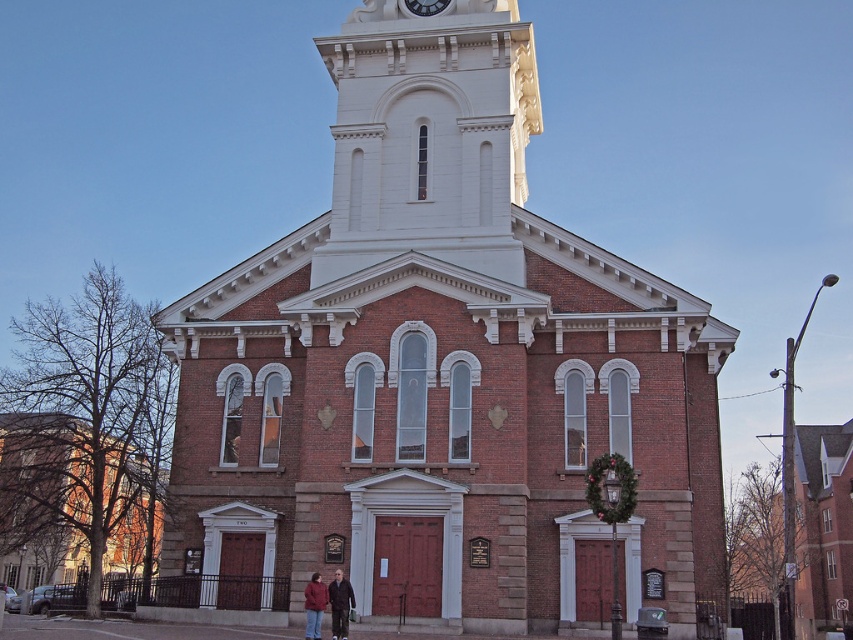
Question: Which object appears closest to the camera in this image?

Choices:
 (A) white stone clock tower at upper center
 (B) white glossy clock at upper center
 (C) matte brown jacket at center
 (D) brick church at center

Answer: (C)

Question: Which point is farther to the camera?

Choices:
 (A) matte brown jacket at center
 (B) white glossy clock at upper center

Answer: (B)

Question: Can you confirm if brick church at center is wider than white stone clock tower at upper center?

Choices:
 (A) yes
 (B) no

Answer: (A)

Question: Considering the real-world distances, which object is closest to the white glossy clock at upper center?

Choices:
 (A) matte brown jacket at center
 (B) brown brick church at left

Answer: (A)

Question: Does brick church at center come in front of white glossy clock at upper center?

Choices:
 (A) yes
 (B) no

Answer: (A)

Question: Observing the image, what is the correct spatial positioning of brown brick church at left in reference to matte brown jacket at center?

Choices:
 (A) above
 (B) below

Answer: (A)